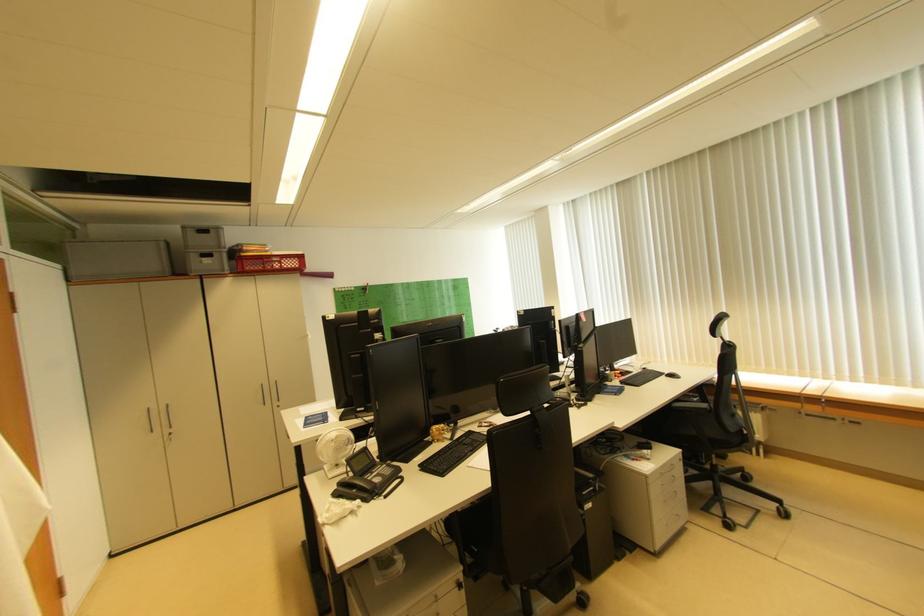
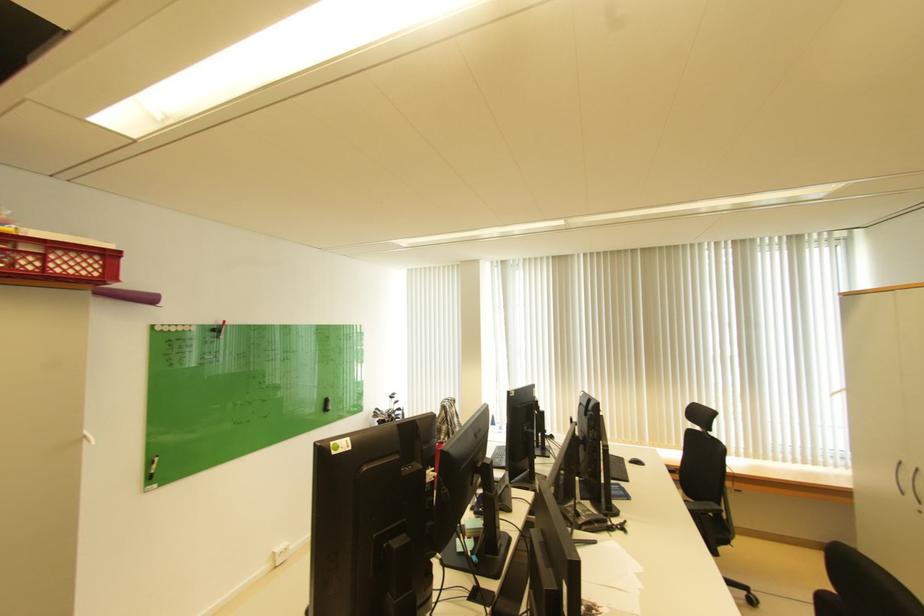
Locate, in the second image, the point that corresponds to (339,277) in the first image.

(160, 301)